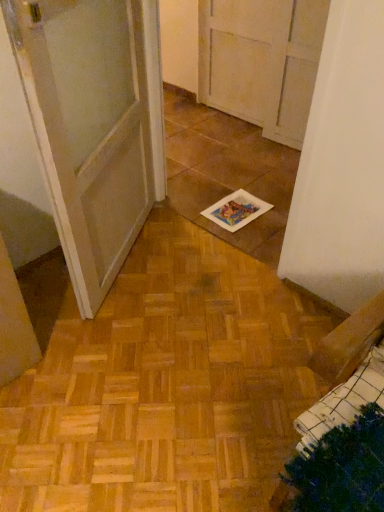
Question: Considering the relative sizes of white glossy door at center and white paper at center in the image provided, is white glossy door at center thinner than white paper at center?

Choices:
 (A) yes
 (B) no

Answer: (A)

Question: Is white glossy door at center at the left side of white paper at center?

Choices:
 (A) yes
 (B) no

Answer: (A)

Question: Does white glossy door at center come behind white paper at center?

Choices:
 (A) no
 (B) yes

Answer: (A)

Question: Can you confirm if white glossy door at center is smaller than white paper at center?

Choices:
 (A) no
 (B) yes

Answer: (A)

Question: From the image's perspective, does white glossy door at center appear lower than white paper at center?

Choices:
 (A) no
 (B) yes

Answer: (A)

Question: Can you confirm if white glossy door at center is shorter than white paper at center?

Choices:
 (A) no
 (B) yes

Answer: (A)

Question: Is white paper at center looking in the opposite direction of white glossy door at center?

Choices:
 (A) no
 (B) yes

Answer: (A)

Question: Considering the relative sizes of white paper at center and white glossy door at center in the image provided, is white paper at center bigger than white glossy door at center?

Choices:
 (A) yes
 (B) no

Answer: (B)

Question: Is white paper at center thinner than white glossy door at center?

Choices:
 (A) yes
 (B) no

Answer: (B)

Question: Can you confirm if white paper at center is shorter than white glossy door at center?

Choices:
 (A) no
 (B) yes

Answer: (B)

Question: Does white paper at center have a greater height compared to white glossy door at center?

Choices:
 (A) yes
 (B) no

Answer: (B)

Question: Does white paper at center lie in front of white glossy door at center?

Choices:
 (A) no
 (B) yes

Answer: (A)

Question: Looking at the image, does white paper at center seem bigger or smaller compared to white glossy door at center?

Choices:
 (A) big
 (B) small

Answer: (B)